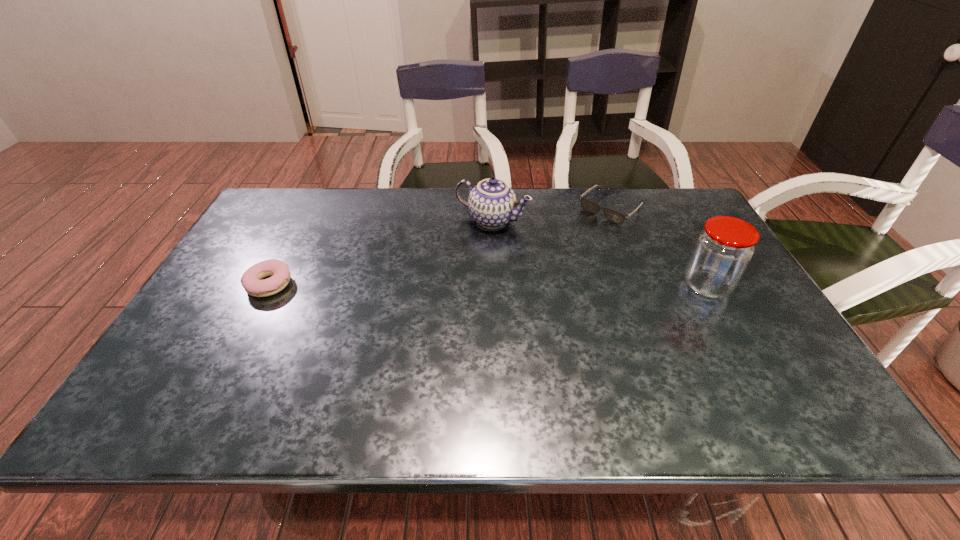
You are a GUI agent. You are given a task and a screenshot of the screen. Output one action in this format:
    pyautogui.click(x=<x>, y=<y>)
    Task: Click on the vacant space at the left edge of the desktop
    The height and width of the screenshot is (540, 960).
    Given the screenshot: What is the action you would take?
    pyautogui.click(x=219, y=329)

This screenshot has width=960, height=540. I want to click on vacant space at the right edge, so click(x=773, y=345).

This screenshot has height=540, width=960. I want to click on vacant space at the far left corner of the desktop, so click(286, 226).

In the image, there is a desktop. Identify the location of free space at the far right corner. The width and height of the screenshot is (960, 540). click(677, 204).

The width and height of the screenshot is (960, 540). In order to click on empty location between the doughnut and the third object from right to left in this screenshot , I will do [381, 253].

At what (x,y) coordinates should I click in order to perform the action: click on unoccupied position between the second object from right to left and the tallest object. Please return your answer as a coordinate pair (x, y). This screenshot has width=960, height=540. Looking at the image, I should click on (659, 247).

Where is `free point between the chinaware and the rightmost object`? free point between the chinaware and the rightmost object is located at coordinates (599, 253).

Locate an element on the screen. This screenshot has width=960, height=540. free space between the chinaware and the tallest object is located at coordinates (599, 253).

Where is `free spot between the jar and the second tallest object`? Image resolution: width=960 pixels, height=540 pixels. free spot between the jar and the second tallest object is located at coordinates (599, 253).

You are a GUI agent. You are given a task and a screenshot of the screen. Output one action in this format:
    pyautogui.click(x=<x>, y=<y>)
    Task: Click on the blank region between the leftmost object and the chinaware
    
    Given the screenshot: What is the action you would take?
    pyautogui.click(x=381, y=253)